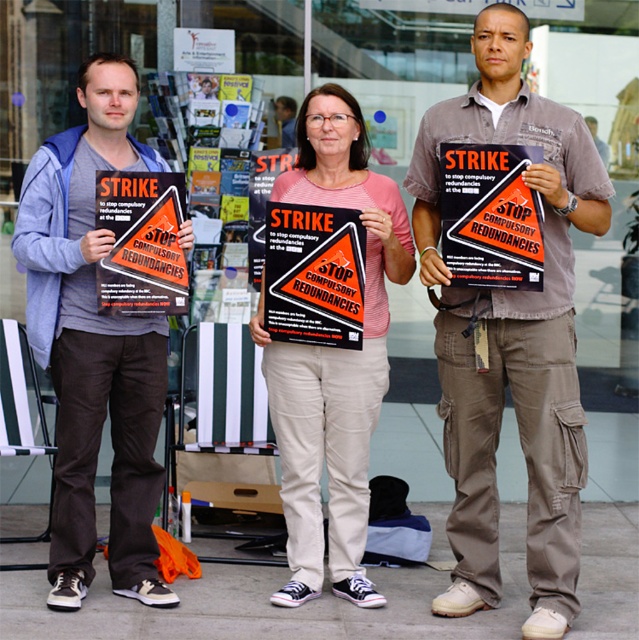
You are a photographer trying to capture the orange paper sign at center and the orange paper poster at center in a single shot. Which object will appear larger in your photo?

The orange paper sign at center will appear larger in the photo because it is closer to the viewer than the orange paper poster at center.